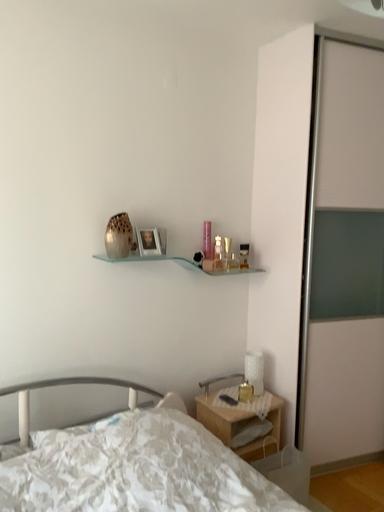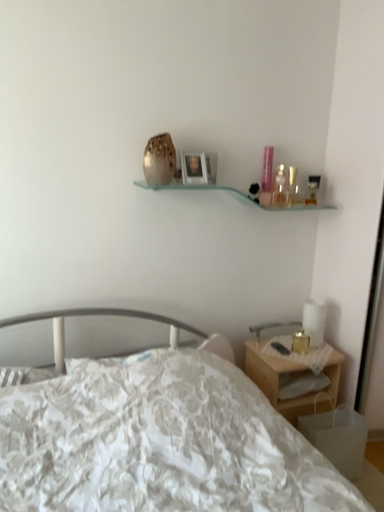
Question: How did the camera likely rotate when shooting the video?

Choices:
 (A) rotated right
 (B) rotated left

Answer: (B)